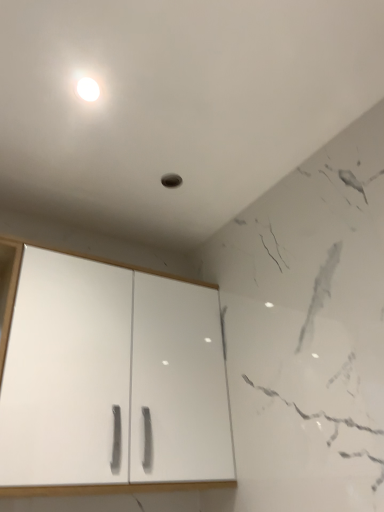
Measure the distance between point [178,432] and camera.

4.70 feet.

This screenshot has height=512, width=384. What do you see at coordinates (111, 380) in the screenshot?
I see `white matte cabinet at center` at bounding box center [111, 380].

Locate an element on the screen. white matte cabinet at center is located at coordinates (111, 380).

What do you see at coordinates (89, 86) in the screenshot?
I see `white glossy light at upper center` at bounding box center [89, 86].

This screenshot has width=384, height=512. I want to click on white glossy light at upper center, so click(89, 86).

The height and width of the screenshot is (512, 384). In order to click on white matte cabinet at center in this screenshot , I will do `click(111, 380)`.

Which object is positioned more to the right, white matte cabinet at center or white glossy light at upper center?

white matte cabinet at center is more to the right.

Is white matte cabinet at center in front of or behind white glossy light at upper center in the image?

Visually, white matte cabinet at center is located in front of white glossy light at upper center.

Does point (220, 376) appear closer or farther from the camera than point (71, 80)?

Point (220, 376) appears to be farther away from the viewer than point (71, 80).

From the image's perspective, relative to white glossy light at upper center, is white matte cabinet at center above or below?

white matte cabinet at center is below white glossy light at upper center.

From a real-world perspective, which is physically above, white matte cabinet at center or white glossy light at upper center?

white glossy light at upper center is physically above.

Looking at this image, is white matte cabinet at center thinner than white glossy light at upper center?

No, white matte cabinet at center is not thinner than white glossy light at upper center.

Between white matte cabinet at center and white glossy light at upper center, which one has more height?

white matte cabinet at center.

Considering the relative sizes of white matte cabinet at center and white glossy light at upper center in the image provided, is white matte cabinet at center smaller than white glossy light at upper center?

Actually, white matte cabinet at center might be larger than white glossy light at upper center.

Is white glossy light at upper center completely or partially inside white matte cabinet at center?

No, white glossy light at upper center is not surrounded by white matte cabinet at center.

Is white matte cabinet at center not close to white glossy light at upper center?

No, white matte cabinet at center is not far away from white glossy light at upper center.

Is white matte cabinet at center positioned with its back to white glossy light at upper center?

white matte cabinet at center is not turned away from white glossy light at upper center.

The height and width of the screenshot is (512, 384). In order to click on cupboard on the right of white glossy light at upper center in this screenshot , I will do `click(111, 380)`.

Is white glossy light at upper center to the right of white matte cabinet at center from the viewer's perspective?

Incorrect, white glossy light at upper center is not on the right side of white matte cabinet at center.

Which is in front, white glossy light at upper center or white matte cabinet at center?

Positioned in front is white matte cabinet at center.

Does point (98, 80) appear closer or farther from the camera than point (185, 300)?

Point (98, 80) appears to be closer to the viewer than point (185, 300).

From the image's perspective, which is above, white glossy light at upper center or white matte cabinet at center?

From the image's view, white glossy light at upper center is above.

From a real-world perspective, is white glossy light at upper center physically below white matte cabinet at center?

No, from a real-world perspective, white glossy light at upper center is not beneath white matte cabinet at center.

Is white glossy light at upper center thinner than white matte cabinet at center?

Indeed, white glossy light at upper center has a lesser width compared to white matte cabinet at center.

Considering the sizes of objects white glossy light at upper center and white matte cabinet at center in the image provided, who is taller, white glossy light at upper center or white matte cabinet at center?

Standing taller between the two is white matte cabinet at center.

Is white glossy light at upper center bigger than white matte cabinet at center?

No.

Is white glossy light at upper center inside the boundaries of white matte cabinet at center, or outside?

white glossy light at upper center cannot be found inside white matte cabinet at center.

Is white glossy light at upper center placed right next to white matte cabinet at center?

white glossy light at upper center and white matte cabinet at center are not in contact.

Is white glossy light at upper center looking in the opposite direction of white matte cabinet at center?

white glossy light at upper center does not have its back to white matte cabinet at center.

How different are the orientations of white glossy light at upper center and white matte cabinet at center in degrees?

The facing directions of white glossy light at upper center and white matte cabinet at center are 1.67 degrees apart.

Locate an element on the screen. The height and width of the screenshot is (512, 384). light that appears behind the white matte cabinet at center is located at coordinates (89, 86).

At what (x,y) coordinates should I click in order to perform the action: click on light on the left of white matte cabinet at center. Please return your answer as a coordinate pair (x, y). The height and width of the screenshot is (512, 384). Looking at the image, I should click on (89, 86).

Locate an element on the screen. Image resolution: width=384 pixels, height=512 pixels. cupboard in front of the white glossy light at upper center is located at coordinates (111, 380).